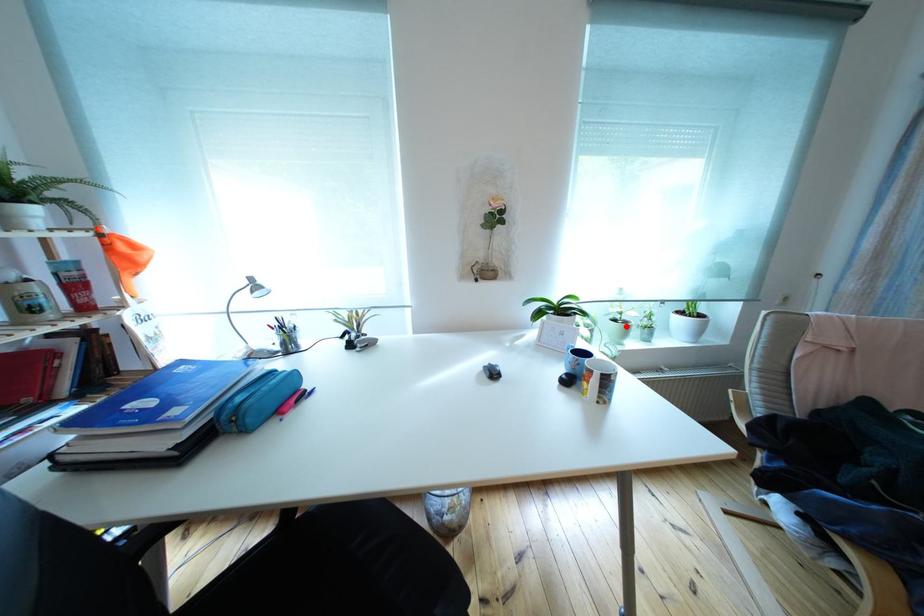
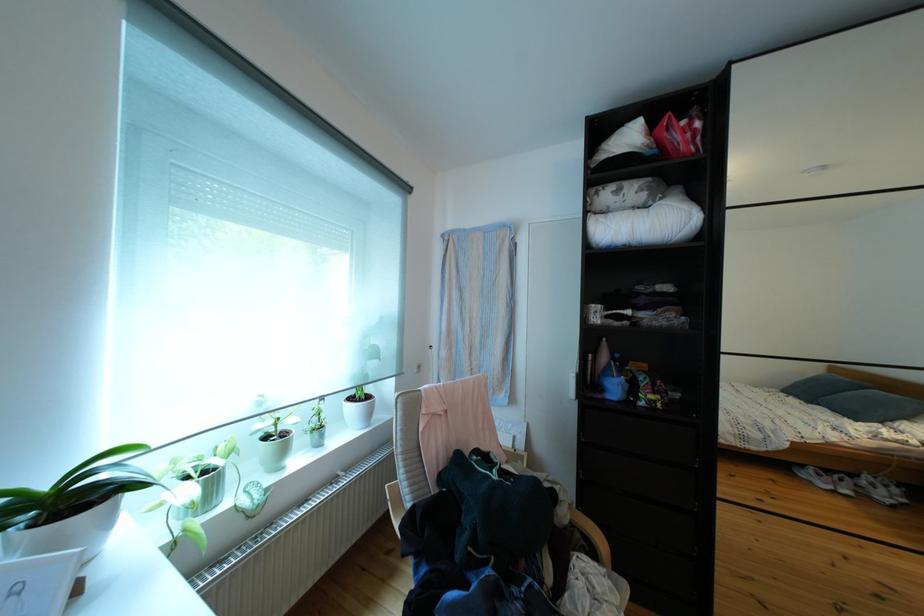
Where in the second image is the point corresponding to the highlighted location from the first image?

(276, 445)